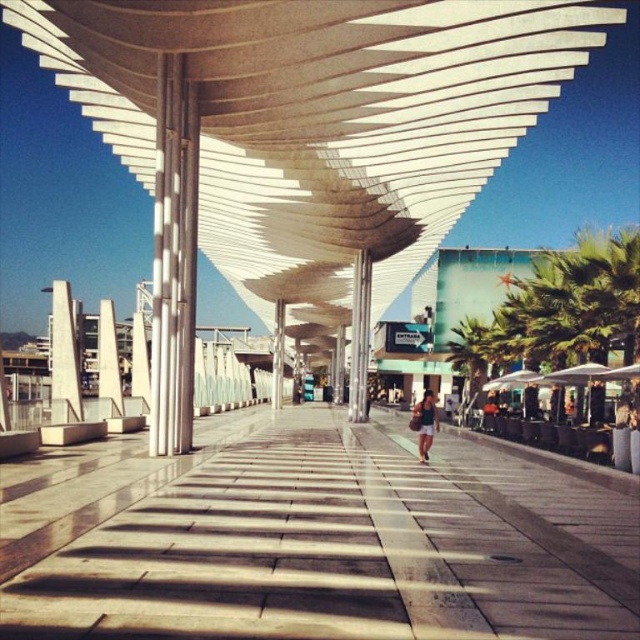
Question: Does white polished stone pavement at center have a smaller size compared to matte black shorts at center?

Choices:
 (A) yes
 (B) no

Answer: (B)

Question: Which point is closer to the camera?

Choices:
 (A) matte black shorts at center
 (B) white polished stone pavement at center

Answer: (B)

Question: Is the position of white polished stone pavement at center less distant than that of matte black shorts at center?

Choices:
 (A) no
 (B) yes

Answer: (B)

Question: Which point appears closest to the camera in this image?

Choices:
 (A) (129, 545)
 (B) (420, 408)

Answer: (A)

Question: Observing the image, what is the correct spatial positioning of white polished stone pavement at center in reference to matte black shorts at center?

Choices:
 (A) right
 (B) left

Answer: (B)